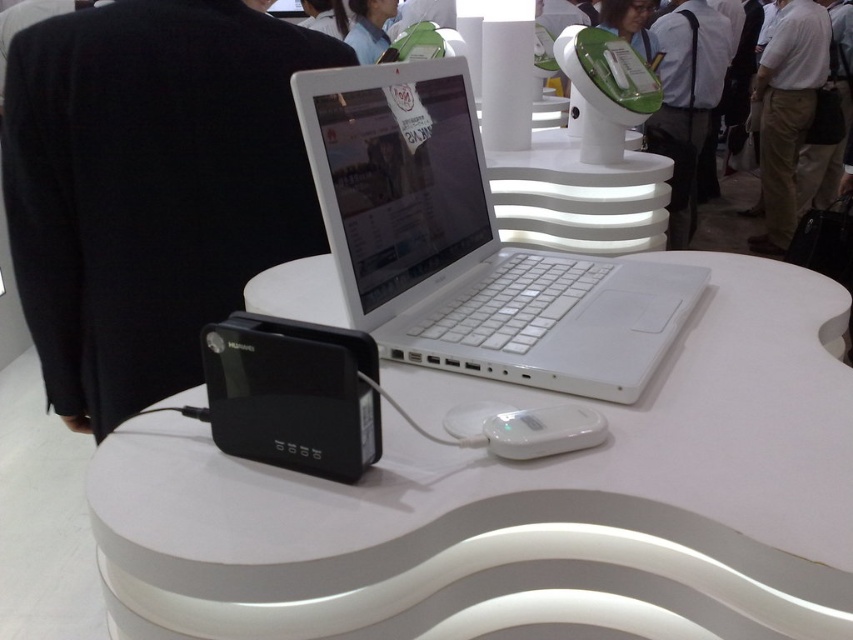
Question: Which point is closer to the camera?

Choices:
 (A) white glossy table at center
 (B) black fabric jacket at left
 (C) white plastic laptop at center

Answer: (A)

Question: Observing the image, what is the correct spatial positioning of matte black laptop at center in reference to blue fabric shirt at upper center?

Choices:
 (A) above
 (B) below

Answer: (B)

Question: Which is nearer to the white fabric shirt at upper center?

Choices:
 (A) khaki cotton pants at center
 (B) matte black laptop at center
 (C) black fabric jacket at left
 (D) white plastic laptop at center

Answer: (B)

Question: Is white glossy table at center thinner than matte black laptop at center?

Choices:
 (A) no
 (B) yes

Answer: (A)

Question: Estimate the real-world distances between objects in this image. Which object is farther from the matte black laptop at center?

Choices:
 (A) black plastic router at lower left
 (B) khaki cotton pants at center

Answer: (A)

Question: Does black fabric jacket at left appear under matte black laptop at center?

Choices:
 (A) yes
 (B) no

Answer: (A)